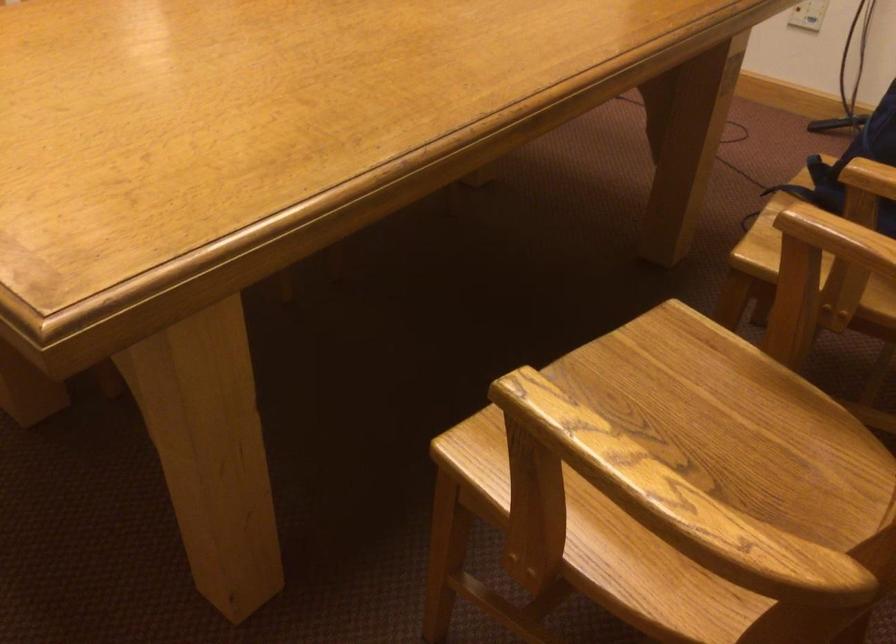
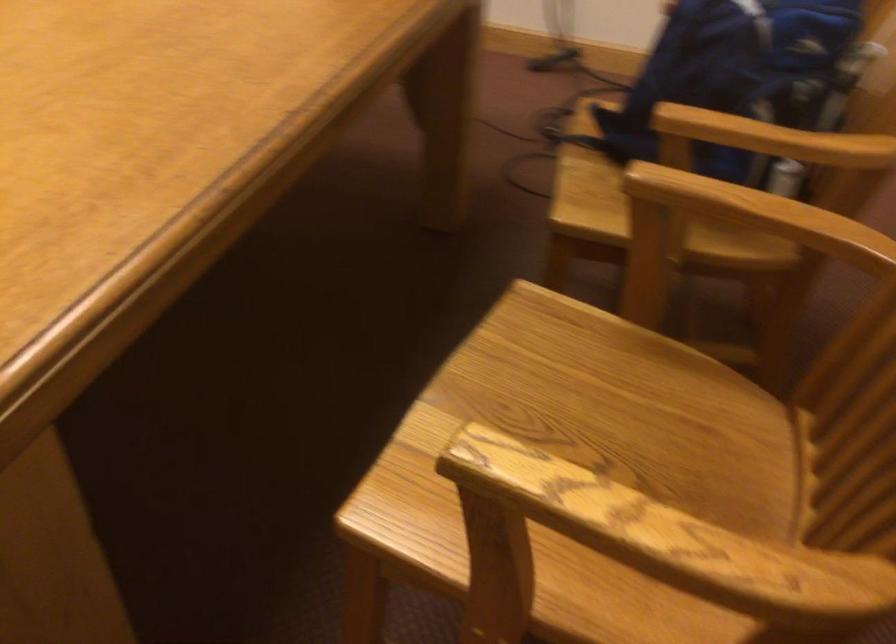
Find the pixel in the second image that matches point 640,489 in the first image.

(658, 542)